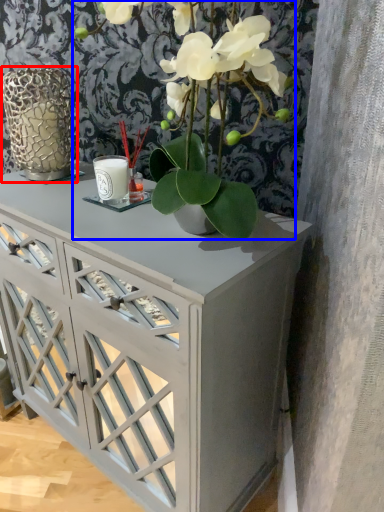
Question: Which point is closer to the camera, glass vase (highlighted by a red box) or houseplant (highlighted by a blue box)?

Choices:
 (A) glass vase
 (B) houseplant

Answer: (B)